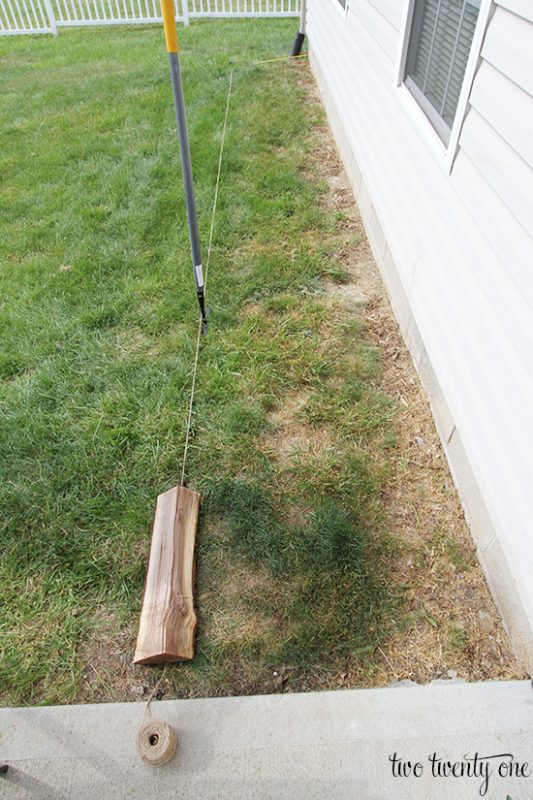
The image size is (533, 800). I want to click on window with the blinds closed, so click(452, 64).